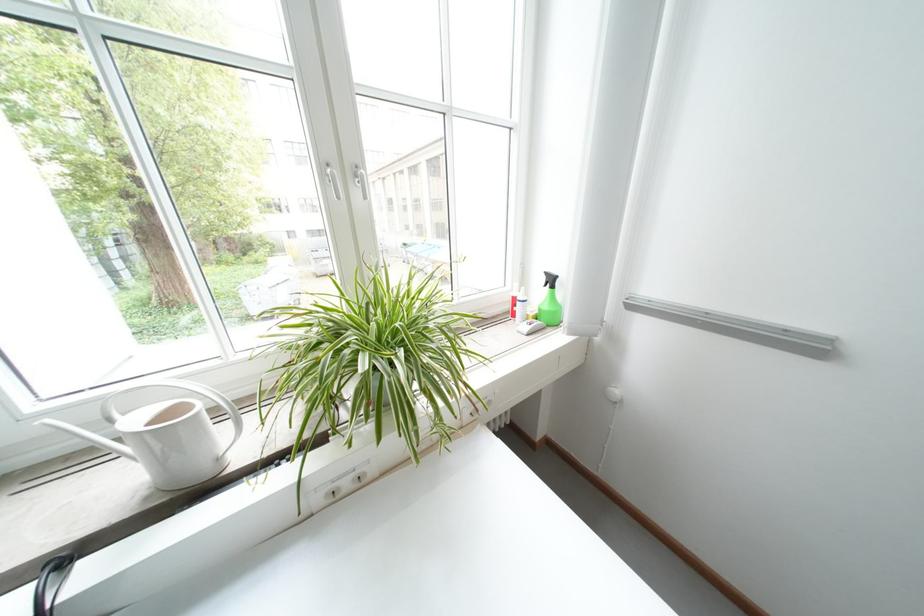
What do you see at coordinates (185, 390) in the screenshot? The image size is (924, 616). I see `the watering can handle` at bounding box center [185, 390].